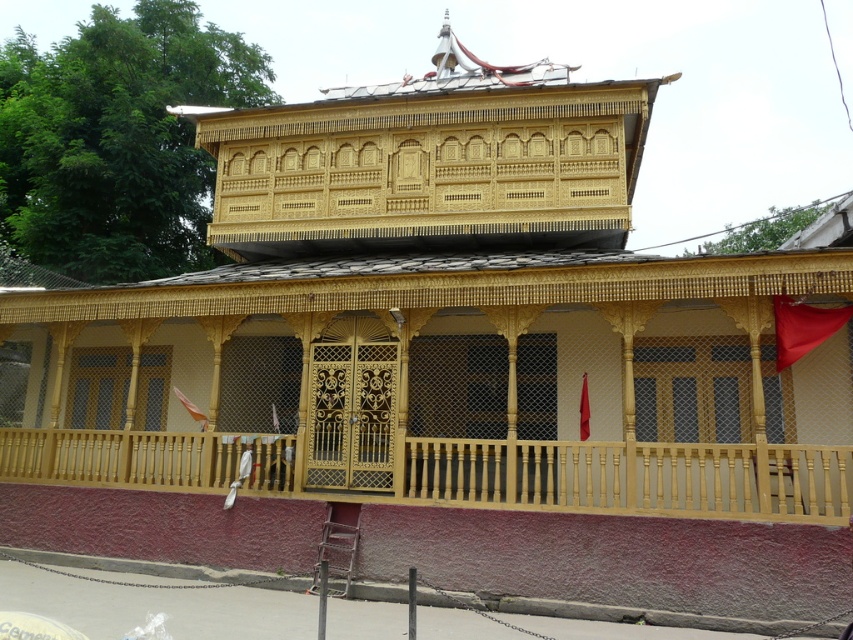
You are an architect evaluating the traditional building. You notice the matte gold balcony at center and the smooth wood balcony at center. Which one has a greater height?

The matte gold balcony at center is much taller than the smooth wood balcony at center.

You are standing in front of the traditional building and want to enter through the entrance. Which balcony, the matte gold balcony at center or the smooth wood balcony at center, is closer to you as you approach the entrance?

The matte gold balcony at center is closer to you because it is in front of the smooth wood balcony at center.

You are standing in front of the traditional building and want to reach the point marked as point (764, 385). If your walking speed is 3 feet per second, how many seconds will it take you to reach that point?

The point (764, 385) is 31.54 feet away from the viewer. At a walking speed of 3 feet per second, it will take approximately 10.5 seconds to reach the point.